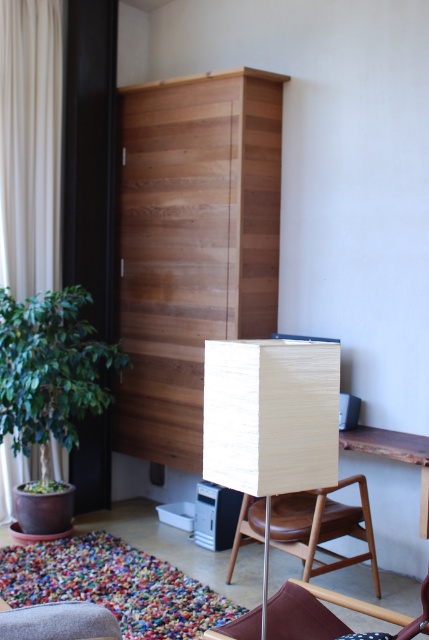
Question: Which point appears closest to the camera in this image?

Choices:
 (A) (307, 499)
 (B) (33, 301)
 (C) (220, 428)
 (D) (12, 147)

Answer: (C)

Question: Is the position of matte wood lamp at center less distant than that of beige fabric curtain at left?

Choices:
 (A) no
 (B) yes

Answer: (B)

Question: Does beige fabric curtain at left have a smaller size compared to velvet burgundy armchair at lower center?

Choices:
 (A) no
 (B) yes

Answer: (A)

Question: Where is wooden armchair at center located in relation to velvet burgundy armchair at lower center in the image?

Choices:
 (A) above
 (B) below

Answer: (B)

Question: Which of these objects is positioned closest to the matte wood lamp at center?

Choices:
 (A) green leafy plant at lower left
 (B) beige fabric curtain at left

Answer: (A)

Question: Which of these objects is positioned closest to the green leafy plant at lower left?

Choices:
 (A) matte wood lamp at center
 (B) velvet burgundy armchair at lower center
 (C) wooden armchair at center
 (D) beige fabric curtain at left

Answer: (D)